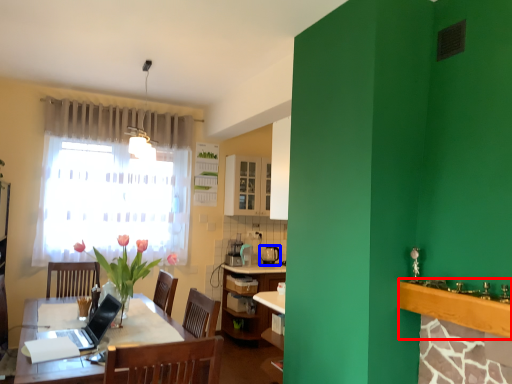
Question: Which of the following is the farthest to the observer, counter top (highlighted by a red box) or appliance (highlighted by a blue box)?

Choices:
 (A) counter top
 (B) appliance

Answer: (B)